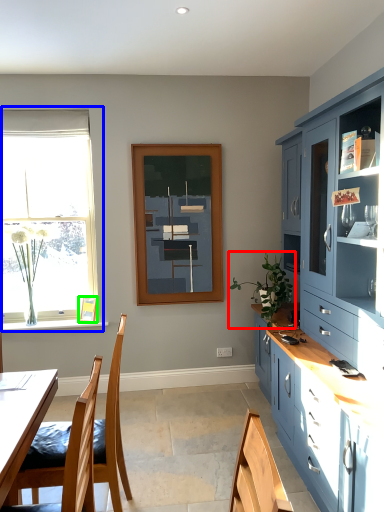
Question: Based on their relative distances, which object is farther from houseplant (highlighted by a red box)? Choose from window (highlighted by a blue box) and picture frame (highlighted by a green box).

Choices:
 (A) window
 (B) picture frame

Answer: (A)